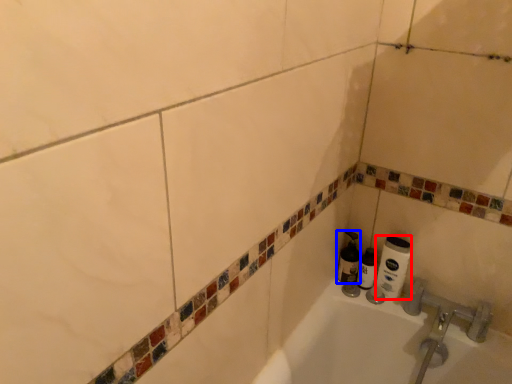
Question: Which object is closer to the camera taking this photo, toilet paper (highlighted by a red box) or shaving cream (highlighted by a blue box)?

Choices:
 (A) toilet paper
 (B) shaving cream

Answer: (A)